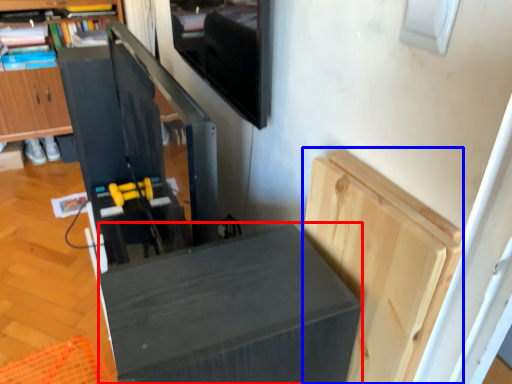
Question: Which point is further to the camera, furniture (highlighted by a red box) or cabinetry (highlighted by a blue box)?

Choices:
 (A) furniture
 (B) cabinetry

Answer: (B)